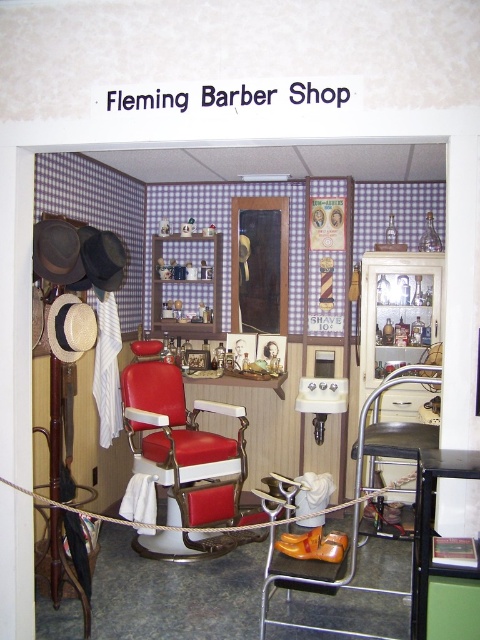
Question: Does matte red barber chair at center have a smaller size compared to black leather stool at center?

Choices:
 (A) yes
 (B) no

Answer: (A)

Question: Is matte red barber chair at center to the right of black leather stool at center from the viewer's perspective?

Choices:
 (A) no
 (B) yes

Answer: (A)

Question: Is matte red barber chair at center smaller than black leather stool at center?

Choices:
 (A) yes
 (B) no

Answer: (A)

Question: Which of the following is the farthest from the observer?

Choices:
 (A) black leather stool at center
 (B) matte red barber chair at center

Answer: (B)